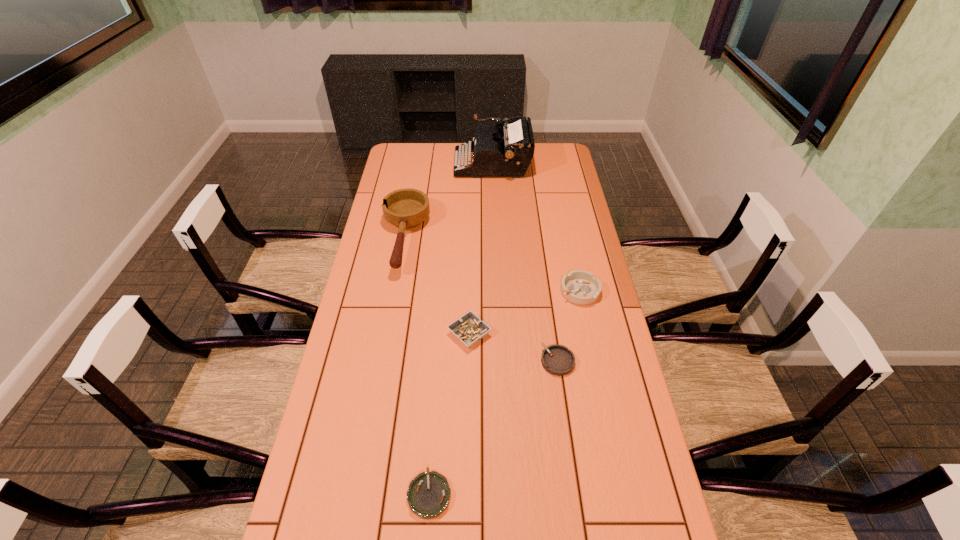
Find the location of a particular element. This screenshot has width=960, height=540. the farthest object is located at coordinates (507, 151).

Find the location of `typewriter`. typewriter is located at coordinates (507, 151).

At what (x,y) coordinates should I click in order to perform the action: click on the leftmost object. Please return your answer as a coordinate pair (x, y). This screenshot has width=960, height=540. Looking at the image, I should click on (407, 208).

At what (x,y) coordinates should I click in order to perform the action: click on the second tallest object. Please return your answer as a coordinate pair (x, y). The height and width of the screenshot is (540, 960). Looking at the image, I should click on (407, 208).

The width and height of the screenshot is (960, 540). In order to click on the farthest ashtray in this screenshot , I will do `click(580, 287)`.

Locate an element on the screen. The image size is (960, 540). the third tallest object is located at coordinates (580, 287).

Where is `the nearest ashtray`? The height and width of the screenshot is (540, 960). the nearest ashtray is located at coordinates (428, 495).

What are the coordinates of `the shortest ashtray` in the screenshot? It's located at (428, 495).

Find the location of `free point located 0.280m on the typing side of the farthest object`. free point located 0.280m on the typing side of the farthest object is located at coordinates (397, 164).

Locate an element on the screen. The height and width of the screenshot is (540, 960). blank space located 0.100m on the typing side of the farthest object is located at coordinates (434, 164).